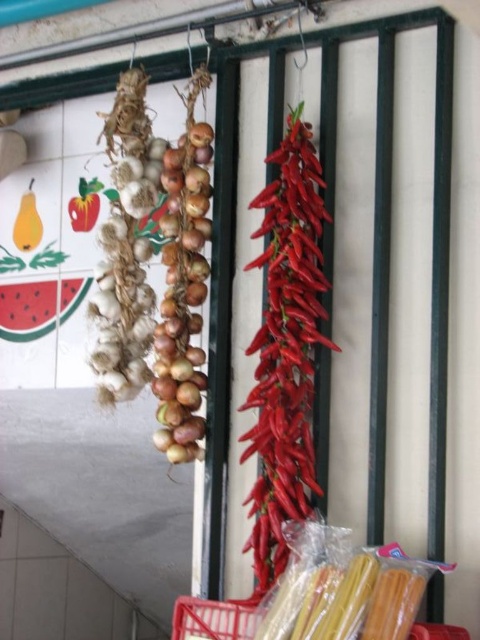
Question: Which object is positioned farthest from the smooth red pepper at upper left?

Choices:
 (A) yellow matte pear at upper left
 (B) metallic red basket at lower center

Answer: (B)

Question: Is yellow matte pear at upper left closer to camera compared to smooth red pepper at upper left?

Choices:
 (A) no
 (B) yes

Answer: (A)

Question: Which point is farther to the camera?

Choices:
 (A) yellow matte pear at upper left
 (B) bright red pepper at center
 (C) smooth red pepper at upper left
 (D) metallic red basket at lower center

Answer: (A)

Question: Is bright red pepper at center positioned before yellow matte pear at upper left?

Choices:
 (A) yes
 (B) no

Answer: (A)

Question: Can you confirm if yellow matte pear at upper left is bigger than smooth red pepper at upper left?

Choices:
 (A) no
 (B) yes

Answer: (B)

Question: Which point is closer to the camera?

Choices:
 (A) (202, 627)
 (B) (21, 250)

Answer: (A)